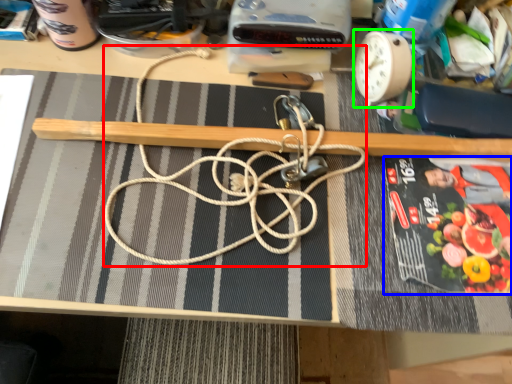
Question: Which is farther away from string (highlighted by a red box)? paperback book (highlighted by a blue box) or clock (highlighted by a green box)?

Choices:
 (A) paperback book
 (B) clock

Answer: (B)